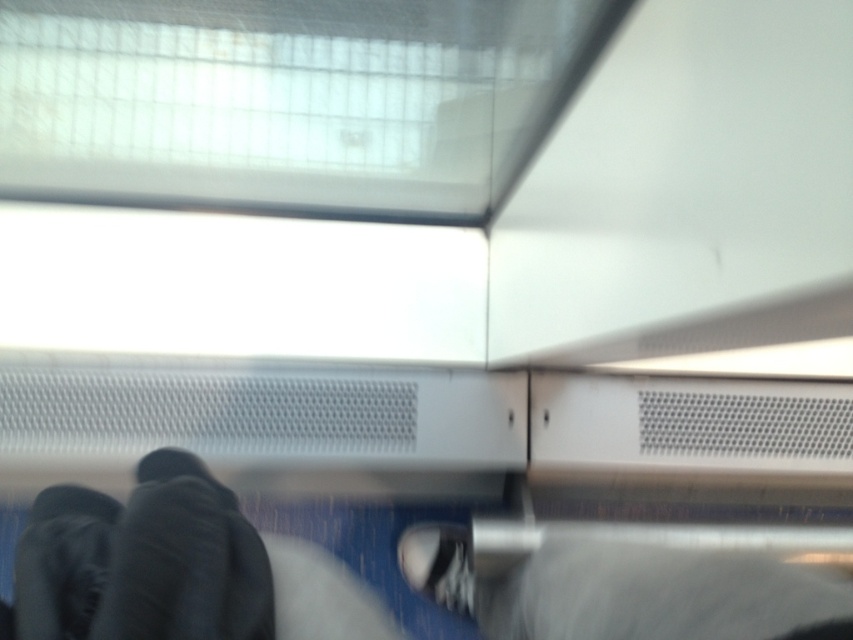
Question: Can you confirm if dark gray fabric jacket at lower left is smaller than white matte shoe at center?

Choices:
 (A) yes
 (B) no

Answer: (B)

Question: Among these objects, which one is farthest from the camera?

Choices:
 (A) white matte shoe at center
 (B) dark gray fabric jacket at lower left

Answer: (A)

Question: Among these points, which one is nearest to the camera?

Choices:
 (A) (428, 580)
 (B) (231, 634)

Answer: (B)

Question: Is dark gray fabric jacket at lower left behind white matte shoe at center?

Choices:
 (A) no
 (B) yes

Answer: (A)

Question: Does dark gray fabric jacket at lower left appear on the right side of white matte shoe at center?

Choices:
 (A) yes
 (B) no

Answer: (B)